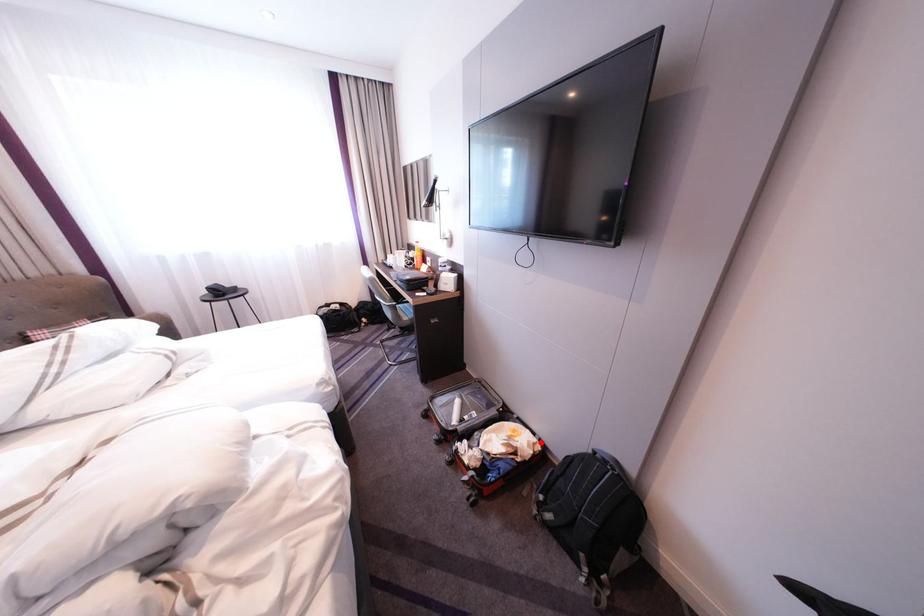
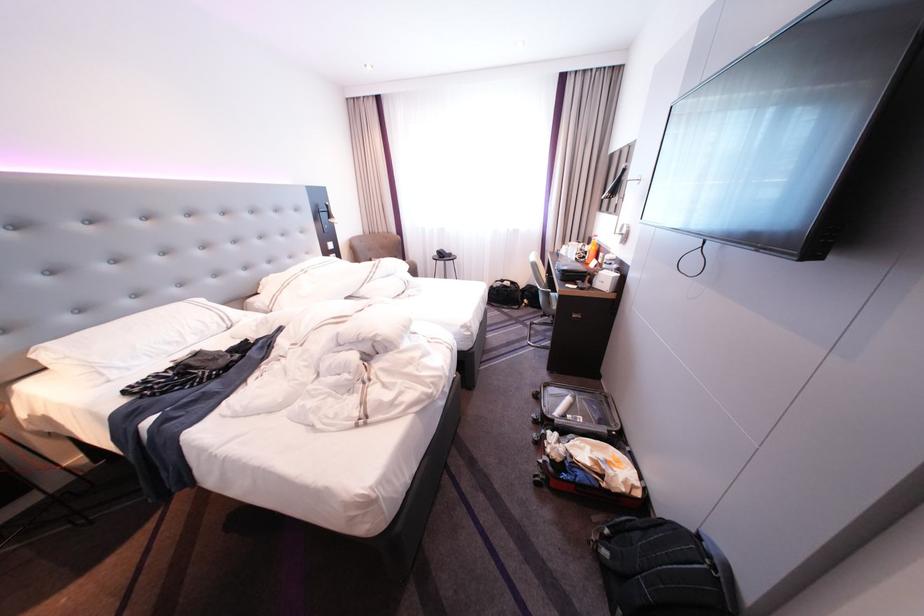
Question: A red point is marked in image1. In image2, is the corresponding 3D point closer to the camera or farther? Reply with the corresponding letter.

Choices:
 (A) The corresponding 3D point is closer.
 (B) The corresponding 3D point is farther.

Answer: (A)